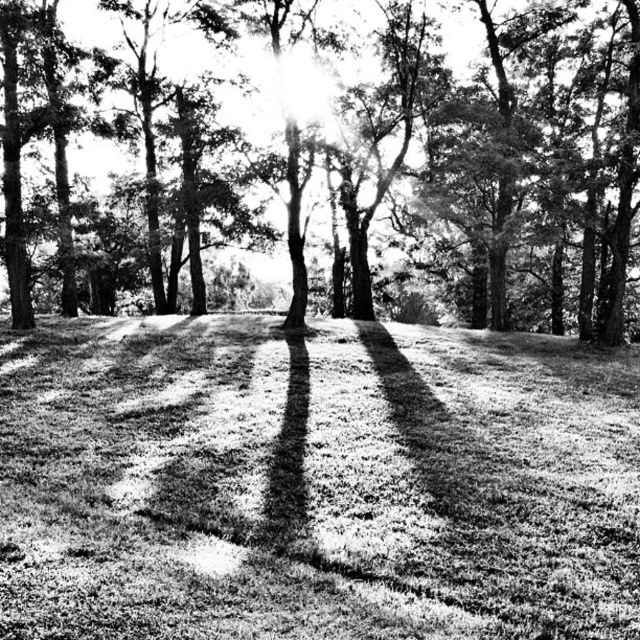
Between grassy at center and smooth bark tree at center, which one has more height?

Standing taller between the two is smooth bark tree at center.

Which is above, grassy at center or smooth bark tree at center?

smooth bark tree at center is higher up.

Does point (74, 547) come closer to viewer compared to point (300, 193)?

Yes.

The width and height of the screenshot is (640, 640). In order to click on grassy at center in this screenshot , I will do `click(314, 483)`.